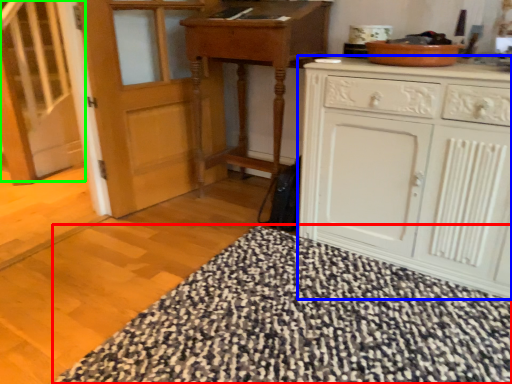
Question: Estimate the real-world distances between objects in this image. Which object is closer to blanket (highlighted by a red box), cabinetry (highlighted by a blue box) or stairs (highlighted by a green box)?

Choices:
 (A) cabinetry
 (B) stairs

Answer: (A)